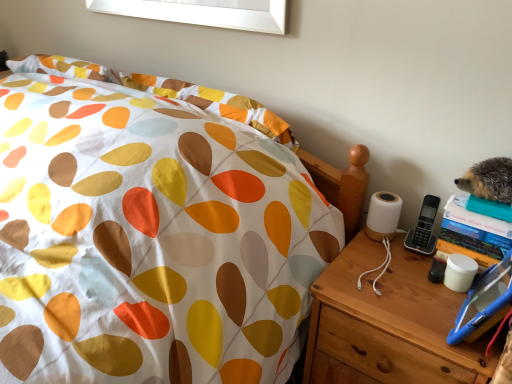
Question: From a real-world perspective, is white fabric bed at center located beneath wooden nightstand at right?

Choices:
 (A) yes
 (B) no

Answer: (B)

Question: Does white fabric bed at center have a larger size compared to wooden nightstand at right?

Choices:
 (A) yes
 (B) no

Answer: (A)

Question: From the image's perspective, is white fabric bed at center under wooden nightstand at right?

Choices:
 (A) no
 (B) yes

Answer: (A)

Question: Is white fabric bed at center wider than wooden nightstand at right?

Choices:
 (A) yes
 (B) no

Answer: (A)

Question: Does white fabric bed at center have a smaller size compared to wooden nightstand at right?

Choices:
 (A) yes
 (B) no

Answer: (B)

Question: Can you see white fabric bed at center touching wooden nightstand at right?

Choices:
 (A) no
 (B) yes

Answer: (A)

Question: From the image's perspective, is wooden nightstand at right under white fabric bed at center?

Choices:
 (A) yes
 (B) no

Answer: (A)

Question: Is wooden nightstand at right thinner than white fabric bed at center?

Choices:
 (A) yes
 (B) no

Answer: (A)

Question: From the image's perspective, is wooden nightstand at right above white fabric bed at center?

Choices:
 (A) yes
 (B) no

Answer: (B)

Question: Can you confirm if wooden nightstand at right is taller than white fabric bed at center?

Choices:
 (A) no
 (B) yes

Answer: (B)

Question: Is wooden nightstand at right aimed at white fabric bed at center?

Choices:
 (A) no
 (B) yes

Answer: (A)

Question: Is wooden nightstand at right surrounding white fabric bed at center?

Choices:
 (A) yes
 (B) no

Answer: (B)

Question: Is wooden nightstand at right situated inside white fabric bed at center or outside?

Choices:
 (A) inside
 (B) outside

Answer: (B)